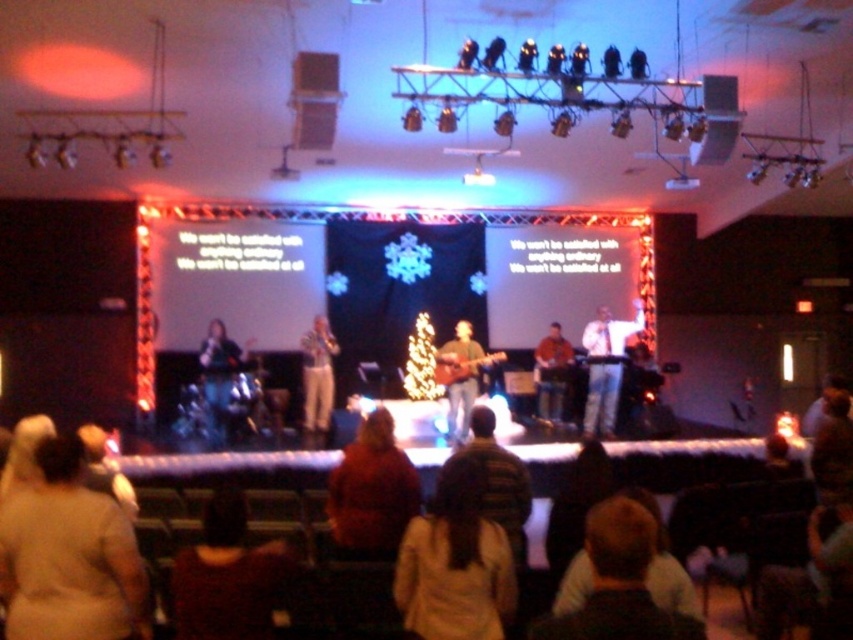
Question: Among these objects, which one is nearest to the camera?

Choices:
 (A) beige wool sweater at lower left
 (B) brown leather guitar at center
 (C) jeans at stage right

Answer: (A)

Question: Observing the image, what is the correct spatial positioning of red velvet sweater at lower center in reference to shiny silver drum set at left?

Choices:
 (A) above
 (B) below

Answer: (B)

Question: Can you confirm if beige wool sweater at lower left is bigger than dark brown hair at lower center?

Choices:
 (A) no
 (B) yes

Answer: (B)

Question: Which object is closer to the camera taking this photo?

Choices:
 (A) matte white pants at center
 (B) beige wool sweater at lower left
 (C) shiny silver drum set at left
 (D) red velvet sweater at lower center

Answer: (B)

Question: Is jeans at stage right to the right of shiny silver drum set at left from the viewer's perspective?

Choices:
 (A) yes
 (B) no

Answer: (A)

Question: Which point is farther to the camera?

Choices:
 (A) light brown hair at center
 (B) beige wool sweater at lower left
 (C) jeans at stage right

Answer: (C)